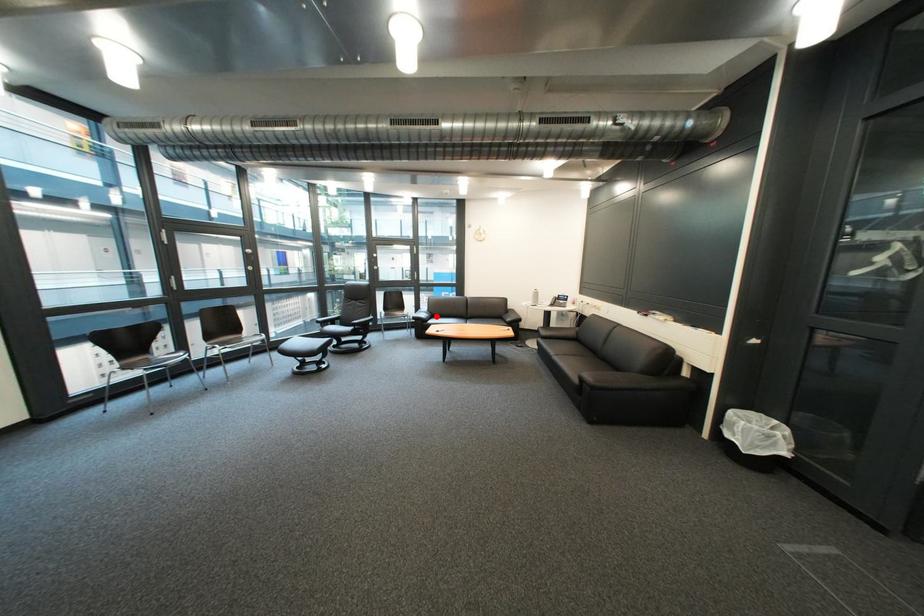
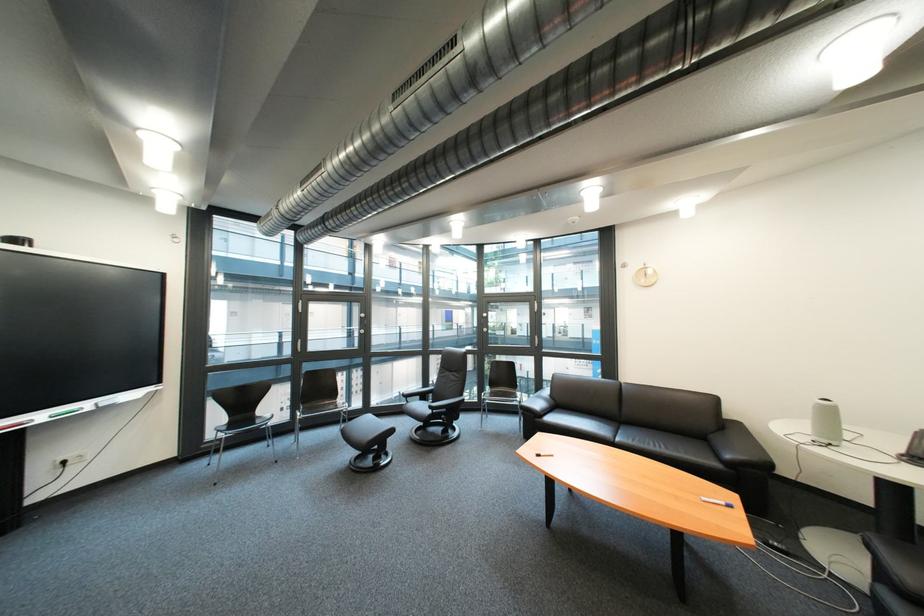
In the second image, find the point that corresponds to the highlighted location in the first image.

(551, 406)